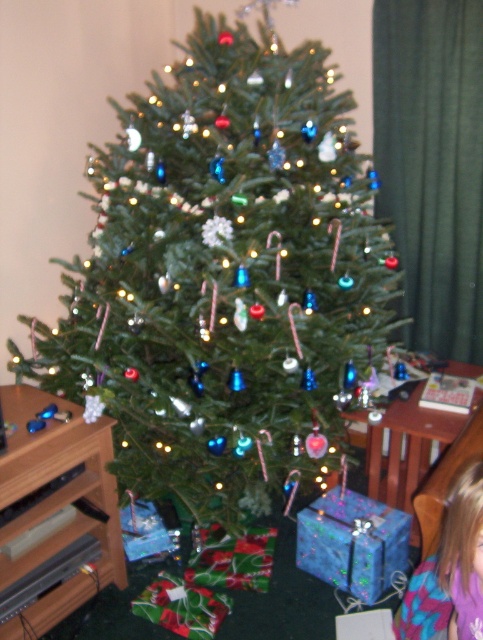
Between green matte christmas tree at center and blonde hair at lower right, which one is positioned higher?

green matte christmas tree at center is above.

Measure the distance between green matte christmas tree at center and blonde hair at lower right.

green matte christmas tree at center and blonde hair at lower right are 83.85 centimeters apart.

Is point (216, 333) farther from camera compared to point (463, 529)?

Yes, it is behind point (463, 529).

The height and width of the screenshot is (640, 483). I want to click on green matte christmas tree at center, so click(x=226, y=276).